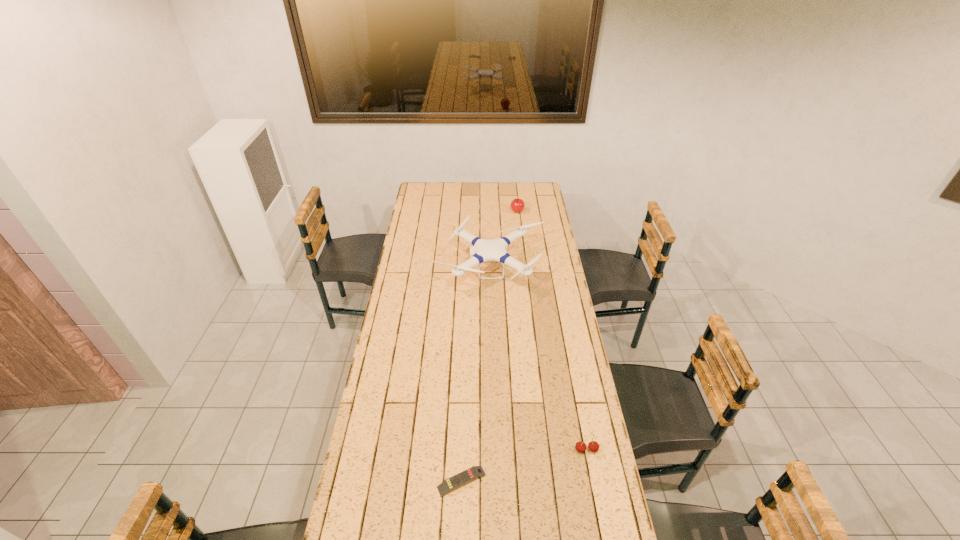
Find the location of a particular element. the tallest object is located at coordinates (485, 250).

Where is `drone`? The width and height of the screenshot is (960, 540). drone is located at coordinates (485, 250).

The width and height of the screenshot is (960, 540). I want to click on the farther cherry, so click(517, 205).

Where is `the left cherry`? the left cherry is located at coordinates (517, 205).

This screenshot has height=540, width=960. I want to click on the nearer cherry, so click(593, 446).

Where is `the second nearest object`? This screenshot has height=540, width=960. the second nearest object is located at coordinates (593, 446).

Locate an element on the screen. Image resolution: width=960 pixels, height=540 pixels. the shortest object is located at coordinates (475, 472).

The image size is (960, 540). Identify the location of the nearest object. (475, 472).

Locate an element on the screen. The width and height of the screenshot is (960, 540). free space located on the front of the tallest object is located at coordinates (492, 332).

You are a GUI agent. You are given a task and a screenshot of the screen. Output one action in this format:
    pyautogui.click(x=<x>, y=<y>)
    Task: Click on the free location located on the front of the farther cherry
    The image size is (960, 540).
    Given the screenshot: What is the action you would take?
    [x=520, y=239]